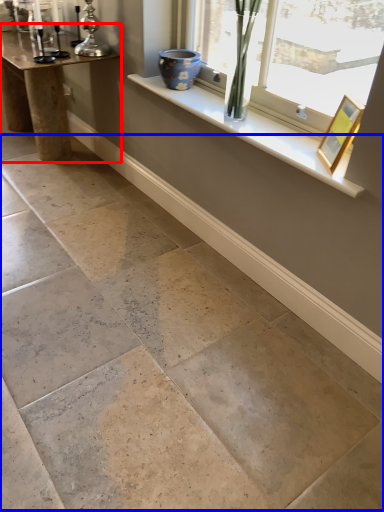
Question: Among these objects, which one is farthest to the camera, table (highlighted by a red box) or concrete (highlighted by a blue box)?

Choices:
 (A) table
 (B) concrete

Answer: (A)